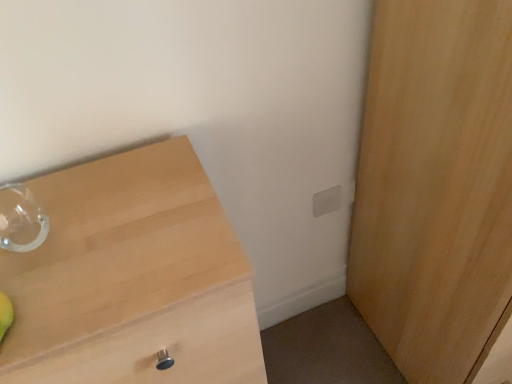
Question: Can you confirm if light wood cupboard at right is bigger than light wood chest of drawers at left?

Choices:
 (A) no
 (B) yes

Answer: (A)

Question: Is light wood cupboard at right touching light wood chest of drawers at left?

Choices:
 (A) yes
 (B) no

Answer: (B)

Question: Is light wood cupboard at right thinner than light wood chest of drawers at left?

Choices:
 (A) yes
 (B) no

Answer: (B)

Question: Considering the relative sizes of light wood cupboard at right and light wood chest of drawers at left in the image provided, is light wood cupboard at right taller than light wood chest of drawers at left?

Choices:
 (A) no
 (B) yes

Answer: (B)

Question: Is light wood chest of drawers at left at the back of light wood cupboard at right?

Choices:
 (A) no
 (B) yes

Answer: (A)

Question: Is light wood cupboard at right shorter than light wood chest of drawers at left?

Choices:
 (A) no
 (B) yes

Answer: (A)

Question: From a real-world perspective, is white matte electric outlet at upper right below light wood chest of drawers at left?

Choices:
 (A) yes
 (B) no

Answer: (B)

Question: Is white matte electric outlet at upper right wider than light wood chest of drawers at left?

Choices:
 (A) yes
 (B) no

Answer: (B)

Question: Is white matte electric outlet at upper right positioned in front of light wood chest of drawers at left?

Choices:
 (A) yes
 (B) no

Answer: (B)

Question: Is white matte electric outlet at upper right to the left of light wood chest of drawers at left from the viewer's perspective?

Choices:
 (A) yes
 (B) no

Answer: (B)

Question: Does white matte electric outlet at upper right have a smaller size compared to light wood chest of drawers at left?

Choices:
 (A) yes
 (B) no

Answer: (A)

Question: From the image's perspective, is white matte electric outlet at upper right below light wood chest of drawers at left?

Choices:
 (A) no
 (B) yes

Answer: (A)

Question: Is light wood chest of drawers at left turned away from white matte electric outlet at upper right?

Choices:
 (A) yes
 (B) no

Answer: (B)